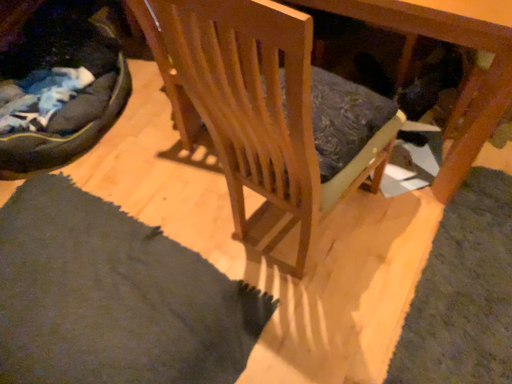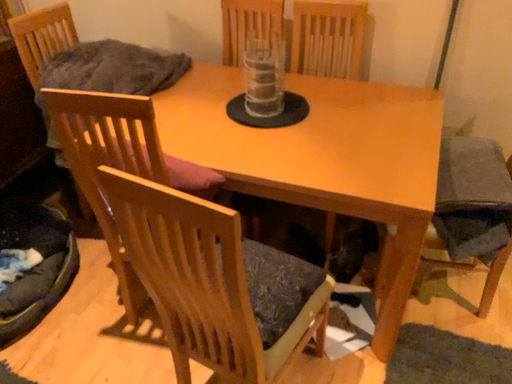
Question: How did the camera likely rotate when shooting the video?

Choices:
 (A) rotated downward
 (B) rotated upward

Answer: (B)